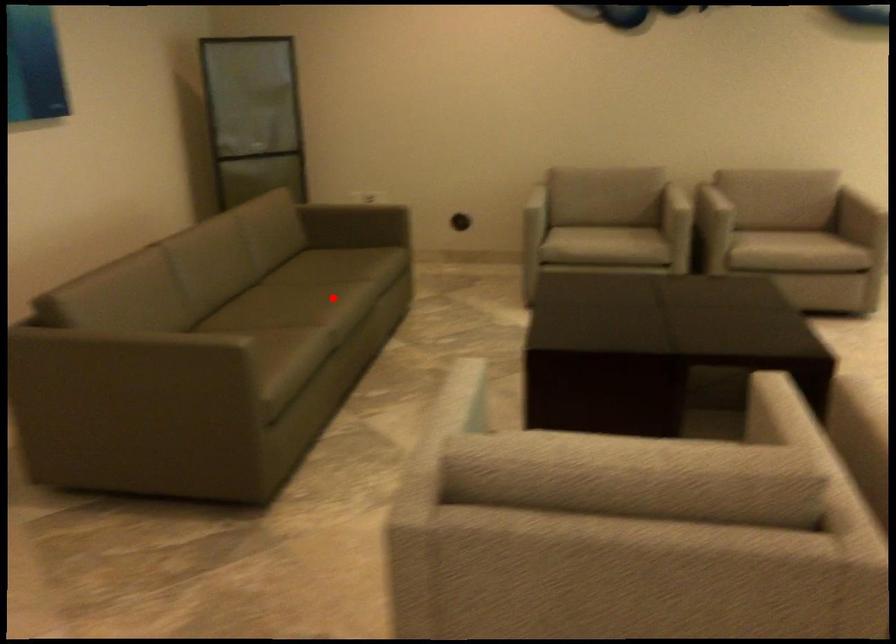
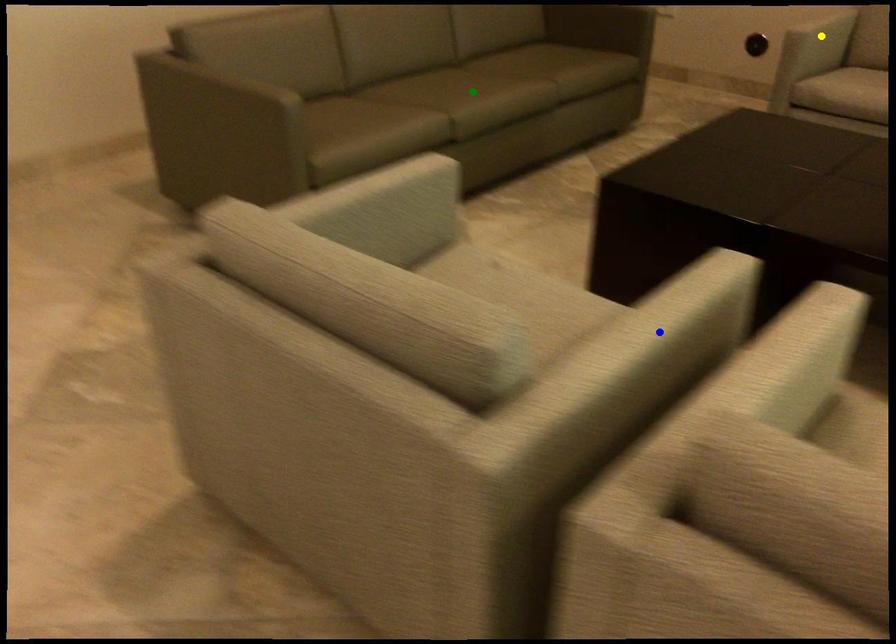
Question: I am providing you with two images of the same scene from different viewpoints. A red point is marked on the first image. You are given multiple points on the second image. In image 2, which mark is for the same physical point as the one in image 1?

Choices:
 (A) green point
 (B) blue point
 (C) yellow point

Answer: (A)